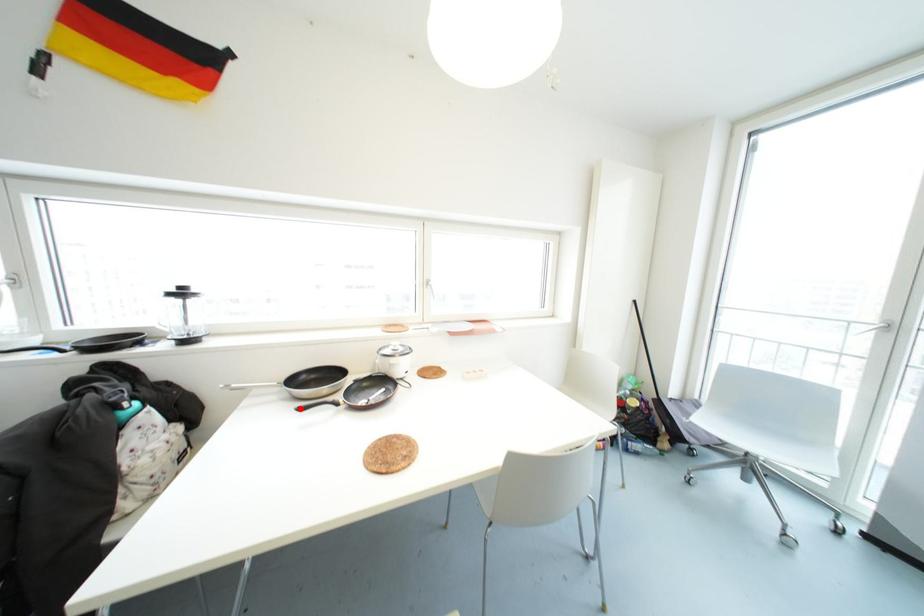
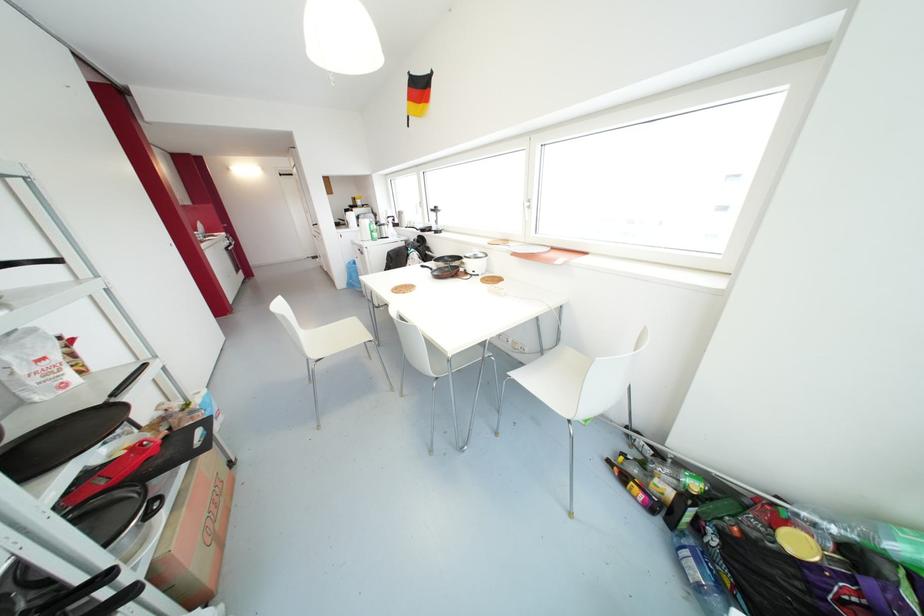
Find the pixel in the second image that matches the highlighted location in the first image.

(421, 265)